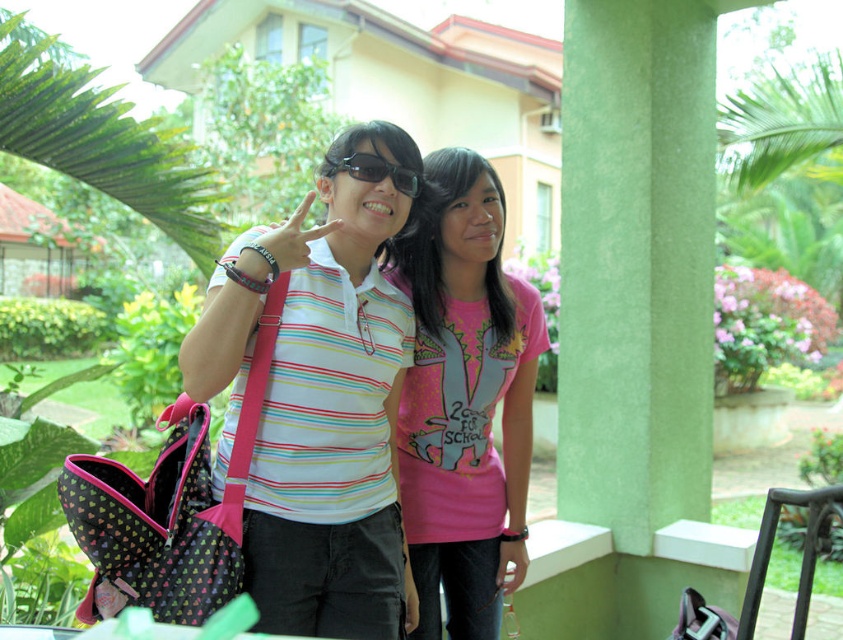
Does striped cotton shirt at center lie behind matte black sunglasses at center?

No, it is in front of matte black sunglasses at center.

Who is positioned more to the left, striped cotton shirt at center or matte black sunglasses at center?

striped cotton shirt at center

Is point (360, 476) positioned after point (419, 177)?

No, (360, 476) is in front of (419, 177).

The height and width of the screenshot is (640, 843). In order to click on striped cotton shirt at center in this screenshot , I will do `click(319, 403)`.

Which of these two, striped cotton shirt at center or pink matte t-shirt at center, stands shorter?

striped cotton shirt at center is shorter.

Which is in front, point (334, 540) or point (492, 612)?

Point (334, 540) is in front.

Measure the distance between point (266, 400) and camera.

They are 6.25 feet apart.

Locate an element on the screen. striped cotton shirt at center is located at coordinates (319, 403).

Is pink matte t-shirt at center positioned behind matte black sunglasses at center?

Yes.

You are a GUI agent. You are given a task and a screenshot of the screen. Output one action in this format:
    pyautogui.click(x=<x>, y=<y>)
    Task: Click on the pink matte t-shirt at center
    This screenshot has height=640, width=843.
    Given the screenshot: What is the action you would take?
    pyautogui.click(x=464, y=401)

Between point (412, 259) and point (374, 161), which one is positioned behind?

Point (412, 259)

Where is `pink matte t-shirt at center`? This screenshot has height=640, width=843. pink matte t-shirt at center is located at coordinates (464, 401).